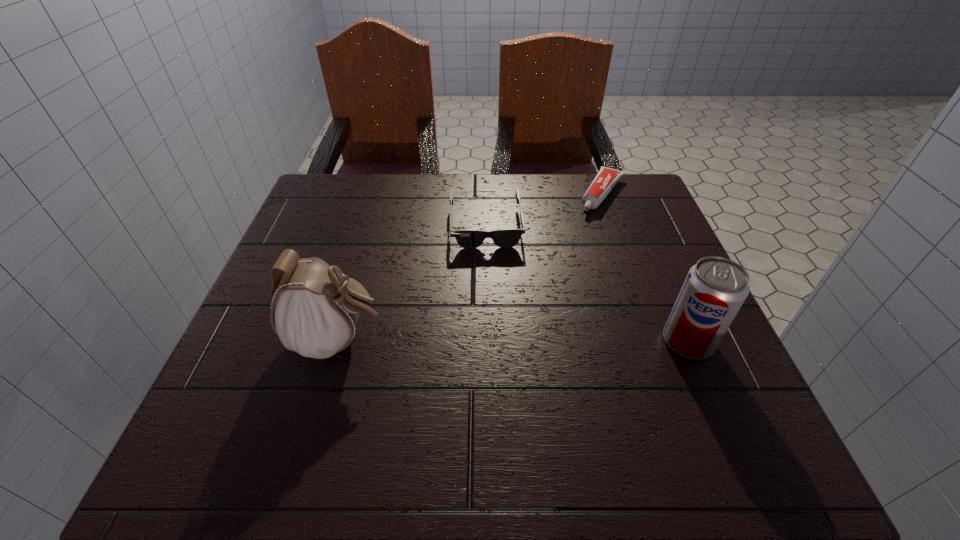
The width and height of the screenshot is (960, 540). I want to click on vacant spot on the desktop that is between the leftmost object and the second tallest object and is positioned on the temples of the sunglasses, so click(x=493, y=341).

Locate an element on the screen. free spot on the desktop that is between the leftmost object and the soda and is positioned at the nozzle of the shortest object is located at coordinates (502, 341).